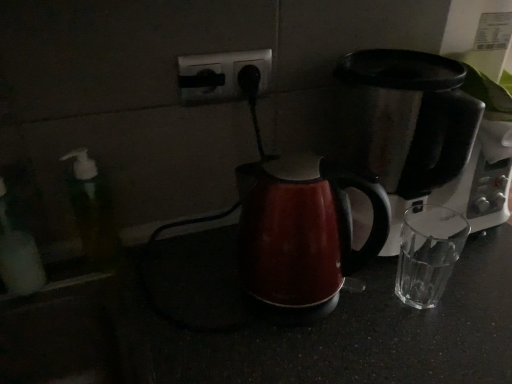
Question: From the image's perspective, relative to translucent plastic soap dispenser at left, is stainless steel coffee maker at right above or below?

Choices:
 (A) above
 (B) below

Answer: (A)

Question: From a real-world perspective, is stainless steel coffee maker at right positioned above or below translucent plastic soap dispenser at left?

Choices:
 (A) below
 (B) above

Answer: (B)

Question: Which object is the farthest from the black plastic outlet at center?

Choices:
 (A) stainless steel coffee maker at right
 (B) translucent plastic soap dispenser at left
 (C) glossy plastic kettle at center

Answer: (A)

Question: Which of these objects is positioned closest to the stainless steel coffee maker at right?

Choices:
 (A) translucent plastic soap dispenser at left
 (B) glossy plastic kettle at center
 (C) black plastic outlet at center

Answer: (B)